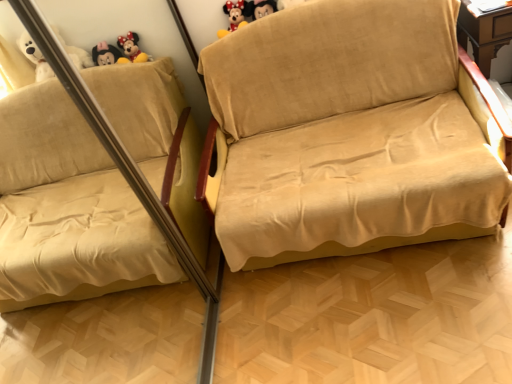
Question: Would you say beige fabric couch at center is outside velvet yellow plush toy at upper center?

Choices:
 (A) no
 (B) yes

Answer: (B)

Question: Is velvet yellow plush toy at upper center at the back of beige fabric couch at center?

Choices:
 (A) no
 (B) yes

Answer: (B)

Question: From the image's perspective, is beige fabric couch at center below velvet yellow plush toy at upper center?

Choices:
 (A) yes
 (B) no

Answer: (A)

Question: Does beige fabric couch at center have a greater height compared to velvet yellow plush toy at upper center?

Choices:
 (A) yes
 (B) no

Answer: (A)

Question: Can you see beige fabric couch at center touching velvet yellow plush toy at upper center?

Choices:
 (A) no
 (B) yes

Answer: (A)

Question: Does beige fabric couch at center appear on the right side of velvet yellow plush toy at upper center?

Choices:
 (A) no
 (B) yes

Answer: (B)

Question: From the image's perspective, is velvet yellow plush toy at upper center under beige fabric couch at center?

Choices:
 (A) no
 (B) yes

Answer: (A)

Question: From a real-world perspective, is velvet yellow plush toy at upper center located beneath beige fabric couch at center?

Choices:
 (A) no
 (B) yes

Answer: (A)

Question: Are velvet yellow plush toy at upper center and beige fabric couch at center located far from each other?

Choices:
 (A) yes
 (B) no

Answer: (B)

Question: Is velvet yellow plush toy at upper center taller than beige fabric couch at center?

Choices:
 (A) yes
 (B) no

Answer: (B)

Question: Is velvet yellow plush toy at upper center aimed at beige fabric couch at center?

Choices:
 (A) yes
 (B) no

Answer: (A)

Question: From the image's perspective, is velvet yellow plush toy at upper center above beige fabric couch at center?

Choices:
 (A) yes
 (B) no

Answer: (A)

Question: Is velvet yellow plush toy at upper center taller or shorter than beige fabric couch at center?

Choices:
 (A) short
 (B) tall

Answer: (A)